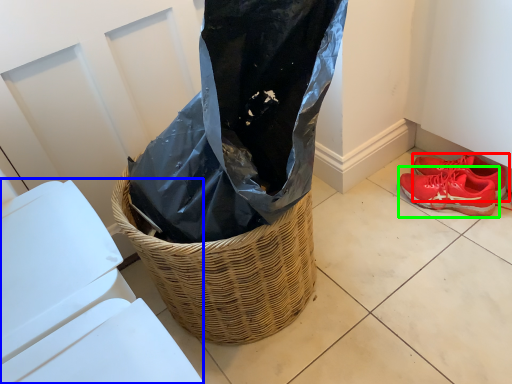
Question: Which is nearer to the footwear (highlighted by a red box)? lift (highlighted by a blue box) or footwear (highlighted by a green box).

Choices:
 (A) lift
 (B) footwear

Answer: (B)